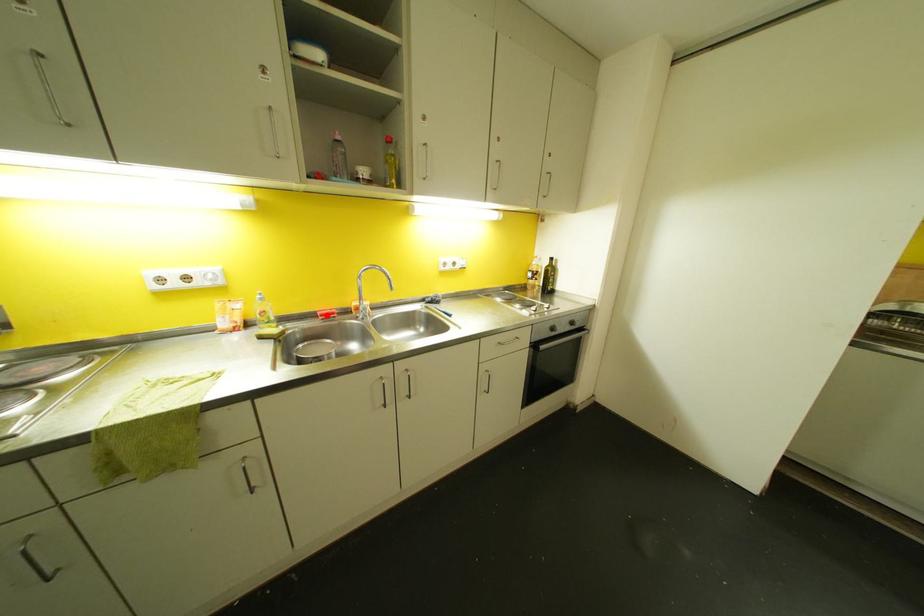
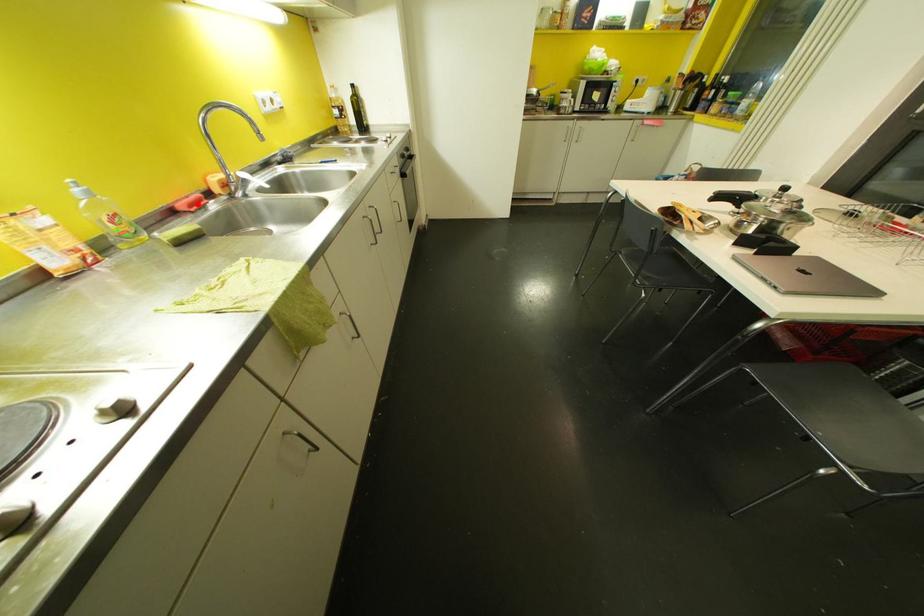
I am providing you with two images of the same scene from different viewpoints. A red point is marked on the first image and another point is marked on the second image. Is the red point in image1 aligned with the point shown in image2?

Yes